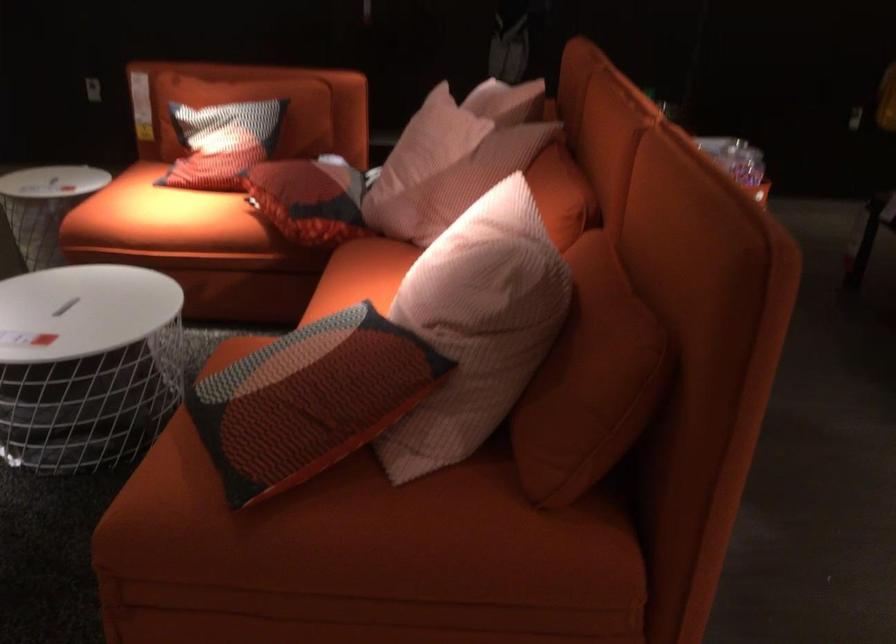
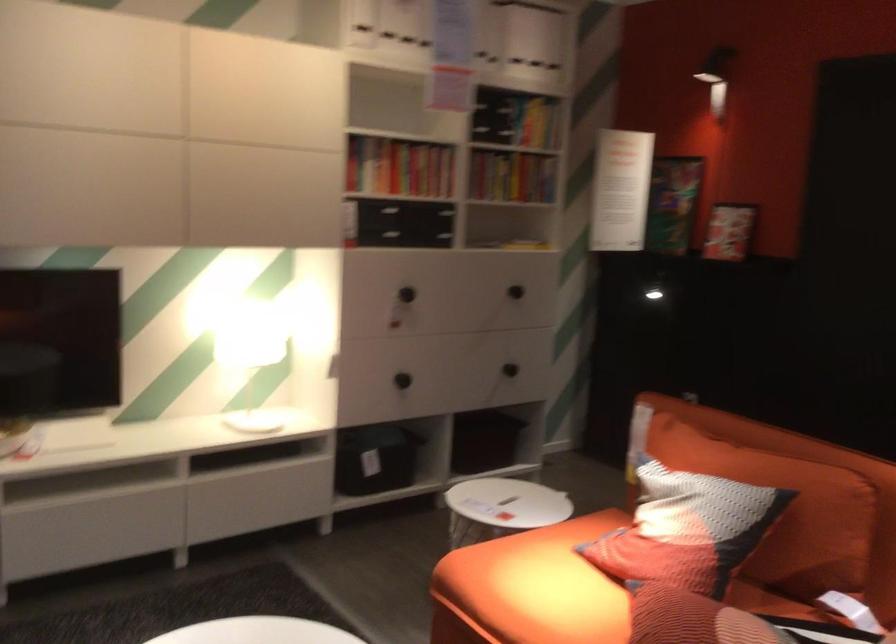
Where in the second image is the point corresponding to pixel 152 212 from the first image?

(531, 588)